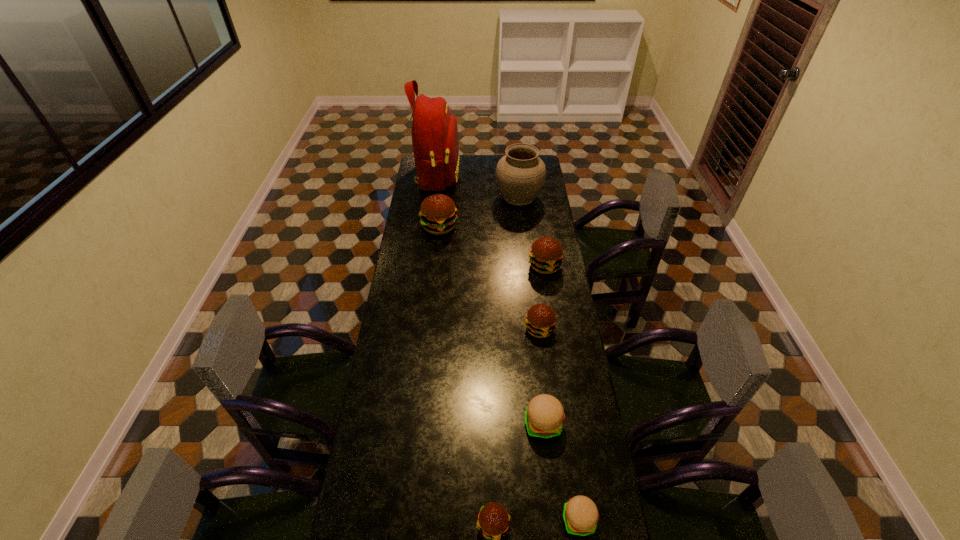
The image size is (960, 540). Find the location of `brown hamburger object that ranks as the third closest to the smaller beige hamburger`. brown hamburger object that ranks as the third closest to the smaller beige hamburger is located at coordinates (546, 253).

In order to click on vacant space that satisfies the following two spatial constraints: 1. on the front-facing side of the backpack; 2. on the right side of the third nearest brown hamburger in this screenshot , I will do `click(426, 266)`.

This screenshot has height=540, width=960. I want to click on vacant space that satisfies the following two spatial constraints: 1. on the front-facing side of the pink backpack; 2. on the left side of the smaller beige hamburger, so click(x=395, y=520).

The image size is (960, 540). I want to click on free location that satisfies the following two spatial constraints: 1. on the front-facing side of the backpack; 2. on the right side of the third nearest object, so click(406, 424).

This screenshot has height=540, width=960. What are the coordinates of `vacant space that satisfies the following two spatial constraints: 1. on the front-facing side of the backpack; 2. on the left side of the fourth farthest hamburger` in the screenshot? It's located at (406, 424).

I want to click on free space that satisfies the following two spatial constraints: 1. on the front-facing side of the fifth nearest hamburger; 2. on the left side of the backpack, so click(x=426, y=266).

The height and width of the screenshot is (540, 960). I want to click on vacant area that satisfies the following two spatial constraints: 1. on the front-facing side of the pink backpack; 2. on the back side of the smaller beige hamburger, so click(x=395, y=520).

At what (x,y) coordinates should I click in order to perform the action: click on vacant space that satisfies the following two spatial constraints: 1. on the front-facing side of the tallest hamburger; 2. on the left side of the pink backpack. Please return your answer as a coordinate pair (x, y). The width and height of the screenshot is (960, 540). Looking at the image, I should click on (431, 227).